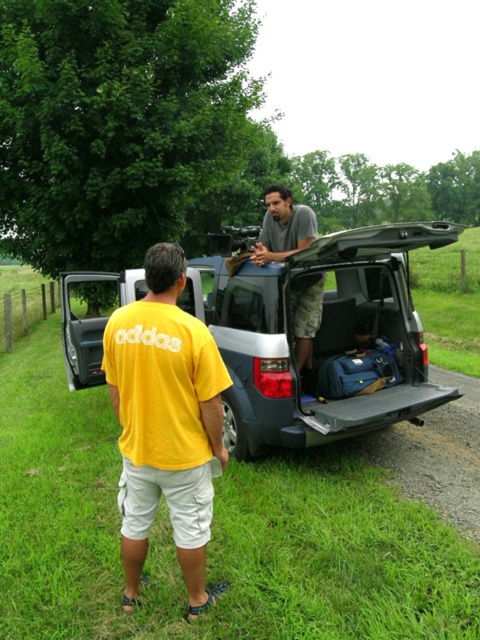
Question: Which of the following is the closest to the observer?

Choices:
 (A) yellow cotton shirt at center
 (B) gray cotton shirt at center
 (C) satin silver jeep at center

Answer: (A)

Question: Is satin silver jeep at center wider than gray cotton shirt at center?

Choices:
 (A) yes
 (B) no

Answer: (A)

Question: Does yellow cotton shirt at center have a larger size compared to gray cotton shirt at center?

Choices:
 (A) yes
 (B) no

Answer: (B)

Question: Among these objects, which one is nearest to the camera?

Choices:
 (A) satin silver jeep at center
 (B) yellow cotton shirt at center

Answer: (B)

Question: Among these points, which one is farthest from the camera?

Choices:
 (A) (144, 483)
 (B) (300, 330)

Answer: (B)

Question: Considering the relative positions of satin silver jeep at center and yellow cotton shirt at center in the image provided, where is satin silver jeep at center located with respect to yellow cotton shirt at center?

Choices:
 (A) right
 (B) left

Answer: (B)